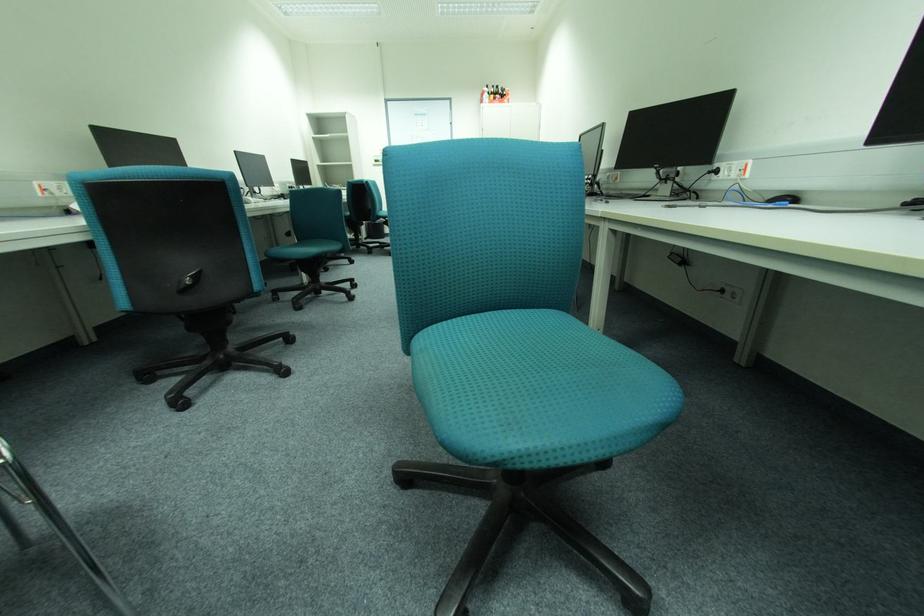
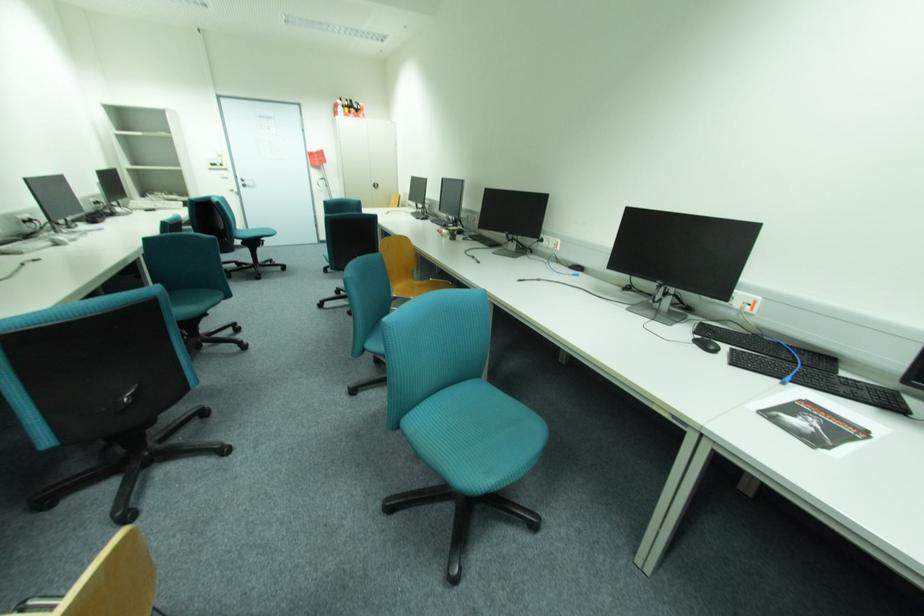
Find the pixel in the second image that matches point (193, 281) in the first image.

(134, 399)